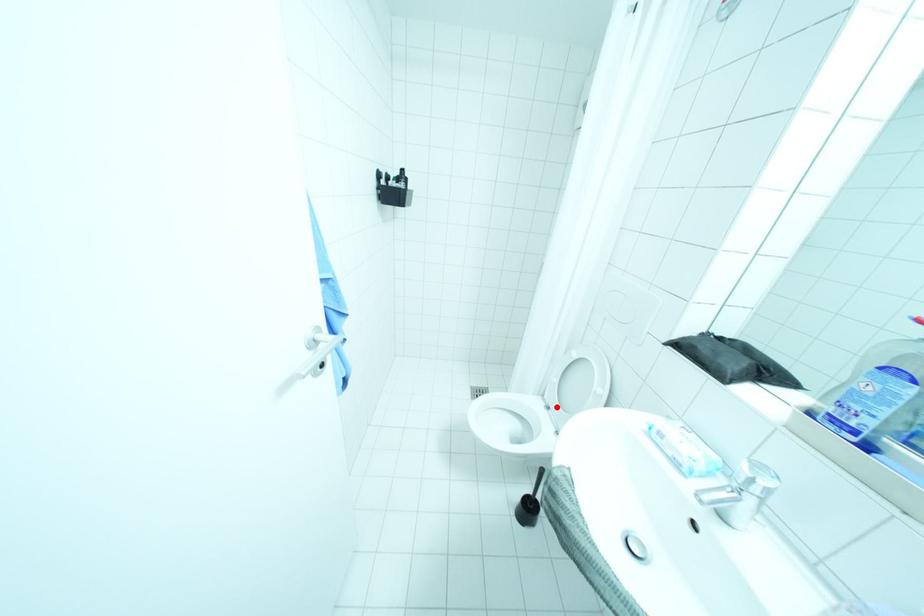
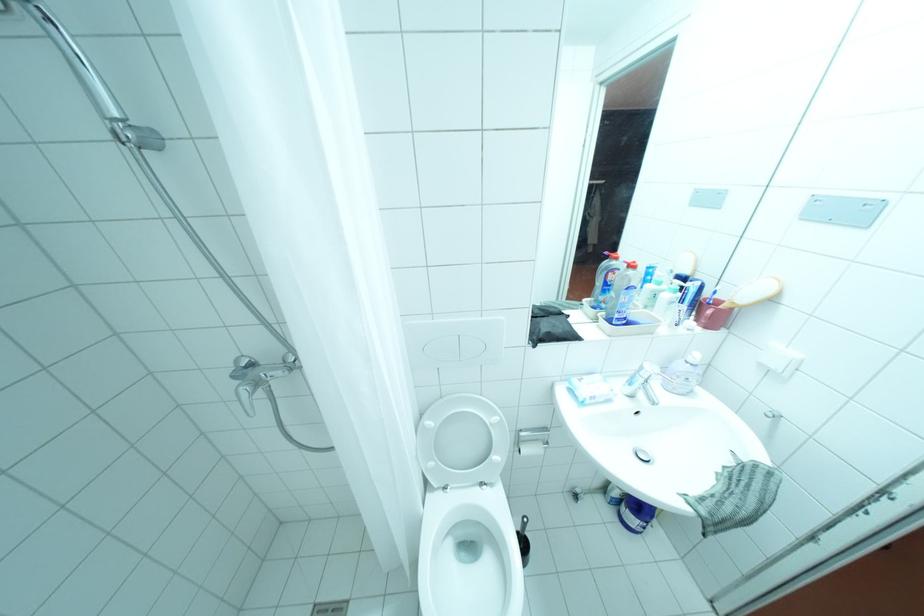
Question: I am providing you with two images of the same scene from different viewpoints. Given a red point in image1, look at the same physical point in image2. Is it:

Choices:
 (A) Closer to the viewpoint
 (B) Farther from the viewpoint

Answer: (B)